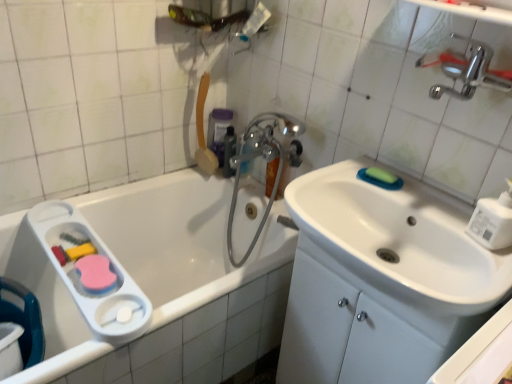
Image resolution: width=512 pixels, height=384 pixels. What do you see at coordinates (218, 131) in the screenshot?
I see `purple plastic mouthwash at upper center, the second mouthwash when ordered from front to back` at bounding box center [218, 131].

The height and width of the screenshot is (384, 512). I want to click on polished chrome faucet at upper right, so (x=466, y=70).

How different are the orientations of white glossy sink at center right and polished chrome faucet at upper right in degrees?

They differ by 0.811 degrees in their facing directions.

This screenshot has height=384, width=512. I want to click on sink that appears in front of the polished chrome faucet at upper right, so click(400, 240).

Considering the relative sizes of white glossy sink at center right and polished chrome faucet at upper right in the image provided, is white glossy sink at center right thinner than polished chrome faucet at upper right?

Incorrect, the width of white glossy sink at center right is not less than that of polished chrome faucet at upper right.

Is white glossy sink at center right turned away from polished chrome faucet at upper right?

No, white glossy sink at center right's orientation is not away from polished chrome faucet at upper right.

Is point (501, 231) in front of point (276, 152)?

Yes.

From a real-world perspective, which object stands above the other?

white plastic soap dispenser at right, from a real-world perspective.

From the image's perspective, who appears lower, white plastic soap dispenser at right or chrome metallic faucet at upper center?

white plastic soap dispenser at right appears lower in the image.

Which object is closer to the camera, white plastic soap dispenser at right or chrome metallic faucet at upper center?

Positioned in front is white plastic soap dispenser at right.

Is chrome metallic faucet at upper center in contact with green matte soap at upper right?

No, chrome metallic faucet at upper center is not touching green matte soap at upper right.

From the image's perspective, is chrome metallic faucet at upper center located above green matte soap at upper right?

Incorrect, from the image's perspective, chrome metallic faucet at upper center is lower than green matte soap at upper right.

Could you tell me if chrome metallic faucet at upper center is turned towards green matte soap at upper right?

No, chrome metallic faucet at upper center is not turned towards green matte soap at upper right.

Is white plastic soap dispenser at right placed right next to polished chrome faucet at upper right?

No, white plastic soap dispenser at right is not with polished chrome faucet at upper right.

From a real-world perspective, between white plastic soap dispenser at right and polished chrome faucet at upper right, who is vertically lower?

white plastic soap dispenser at right is physically lower.

Is white plastic soap dispenser at right completely or partially outside of polished chrome faucet at upper right?

Absolutely, white plastic soap dispenser at right is external to polished chrome faucet at upper right.

Is white plastic soap dispenser at right oriented towards polished chrome faucet at upper right?

No, white plastic soap dispenser at right is not turned towards polished chrome faucet at upper right.

Is polished chrome faucet at upper right to the left or to the right of green matte soap at upper right in the image?

Based on their positions, polished chrome faucet at upper right is located to the right of green matte soap at upper right.

From the image's perspective, which is above, polished chrome faucet at upper right or green matte soap at upper right?

From the image's view, polished chrome faucet at upper right is above.

Could you tell me if polished chrome faucet at upper right is turned towards green matte soap at upper right?

No, polished chrome faucet at upper right is not facing towards green matte soap at upper right.

Measure the distance between polished chrome faucet at upper right and green matte soap at upper right.

polished chrome faucet at upper right is 12.94 inches away from green matte soap at upper right.

Considering the relative sizes of polished chrome faucet at upper right and chrome metallic faucet at upper center in the image provided, is polished chrome faucet at upper right shorter than chrome metallic faucet at upper center?

Yes, polished chrome faucet at upper right is shorter than chrome metallic faucet at upper center.

From a real-world perspective, is polished chrome faucet at upper right on chrome metallic faucet at upper center?

Yes, from a real-world perspective, polished chrome faucet at upper right is over chrome metallic faucet at upper center

Are polished chrome faucet at upper right and chrome metallic faucet at upper center located far from each other?

No, polished chrome faucet at upper right is not far from chrome metallic faucet at upper center.

Considering the positions of objects polished chrome faucet at upper right and chrome metallic faucet at upper center in the image provided, who is behind, polished chrome faucet at upper right or chrome metallic faucet at upper center?

chrome metallic faucet at upper center is behind.

At what (x,y) coordinates should I click in order to perform the action: click on plumbing fixture below the white glossy sink at center right (from a real-world perspective). Please return your answer as a coordinate pair (x, y). Looking at the image, I should click on (266, 160).

Can chrome metallic faucet at upper center be found inside white glossy sink at center right?

No.

Is chrome metallic faucet at upper center at the back of white glossy sink at center right?

No, white glossy sink at center right's orientation is not away from chrome metallic faucet at upper center.

Locate an element on the screen. This screenshot has height=384, width=512. tap lying on the right of white glossy sink at center right is located at coordinates (466, 70).

Identify the location of plumbing fixture behind the white plastic soap dispenser at right. The width and height of the screenshot is (512, 384). (266, 160).

When comparing their distances from semi-transparent plastic bottle at upper center, which ranks as the first mouthwash in front-to-back order, does purple plastic mouthwash at upper center, the second mouthwash when ordered from front to back, or white plastic soap dispenser at right seem further?

Among the two, white plastic soap dispenser at right is located further to semi-transparent plastic bottle at upper center, which ranks as the first mouthwash in front-to-back order.

Looking at the image, which one is located closer to white plastic soap dispenser at right, polished chrome faucet at upper right or white glossy sink at center right?

The object closer to white plastic soap dispenser at right is white glossy sink at center right.

From the image, which object appears to be nearer to green matte soap at upper right, chrome metallic faucet at upper center or white plastic soap dispenser at right?

Among the two, white plastic soap dispenser at right is located nearer to green matte soap at upper right.

Which object lies further to the anchor point polished chrome faucet at upper right, purple plastic mouthwash at upper center, positioned as the 1th mouthwash in back-to-front order, or chrome metallic faucet at upper center?

purple plastic mouthwash at upper center, positioned as the 1th mouthwash in back-to-front order, lies further to polished chrome faucet at upper right than the other object.

Looking at the image, which one is located closer to white glossy sink at center right, semi-transparent plastic bottle at upper center, acting as the 2th mouthwash starting from the back, or purple plastic mouthwash at upper center, the second mouthwash when ordered from front to back?

semi-transparent plastic bottle at upper center, acting as the 2th mouthwash starting from the back.

Which object lies nearer to the anchor point chrome metallic faucet at upper center, white glossy sink at center right or purple plastic mouthwash at upper center, positioned as the 1th mouthwash in back-to-front order?

The object closer to chrome metallic faucet at upper center is purple plastic mouthwash at upper center, positioned as the 1th mouthwash in back-to-front order.

Looking at the image, which one is located further to purple plastic mouthwash at upper center, the second mouthwash when ordered from front to back, white glossy sink at center right or polished chrome faucet at upper right?

polished chrome faucet at upper right.

When comparing their distances from white plastic soap dispenser at right, does white glossy sink at center right or semi-transparent plastic bottle at upper center, which ranks as the first mouthwash in front-to-back order, seem closer?

Among the two, white glossy sink at center right is located nearer to white plastic soap dispenser at right.

Where is `soap dispenser positioned between white glossy sink at center right and green matte soap at upper right from near to far`? This screenshot has width=512, height=384. soap dispenser positioned between white glossy sink at center right and green matte soap at upper right from near to far is located at coordinates (493, 221).

Locate an element on the screen. The image size is (512, 384). plumbing fixture located between white plastic soap dispenser at right and semi-transparent plastic bottle at upper center, acting as the 2th mouthwash starting from the back, in the depth direction is located at coordinates (266, 160).

The height and width of the screenshot is (384, 512). In order to click on soap dispenser between white glossy sink at center right and purple plastic mouthwash at upper center, the second mouthwash when ordered from front to back, along the z-axis in this screenshot , I will do `click(493, 221)`.

Locate an element on the screen. This screenshot has width=512, height=384. plumbing fixture located between green matte soap at upper right and semi-transparent plastic bottle at upper center, acting as the 2th mouthwash starting from the back, in the depth direction is located at coordinates point(266,160).